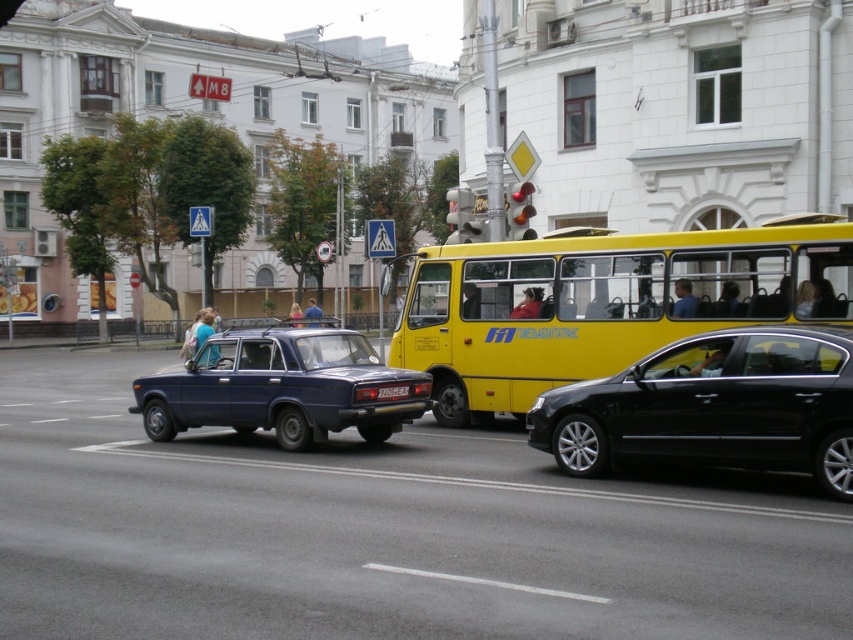
Question: Which object is positioned farthest from the black plastic license plate at center?

Choices:
 (A) yellow matte bus at center
 (B) black metallic car at center
 (C) matte blue sedan at center

Answer: (B)

Question: Which point is closer to the camera?

Choices:
 (A) (711, 380)
 (B) (184, 392)

Answer: (A)

Question: Can you confirm if yellow matte bus at center is positioned above black plastic license plate at center?

Choices:
 (A) no
 (B) yes

Answer: (A)

Question: From the image, what is the correct spatial relationship of yellow matte bus at center in relation to matte blue sedan at center?

Choices:
 (A) left
 (B) right

Answer: (B)

Question: Is yellow matte bus at center further to the viewer compared to matte blue sedan at center?

Choices:
 (A) yes
 (B) no

Answer: (A)

Question: Which of these objects is positioned farthest from the yellow matte bus at center?

Choices:
 (A) black plastic license plate at center
 (B) matte blue sedan at center

Answer: (B)